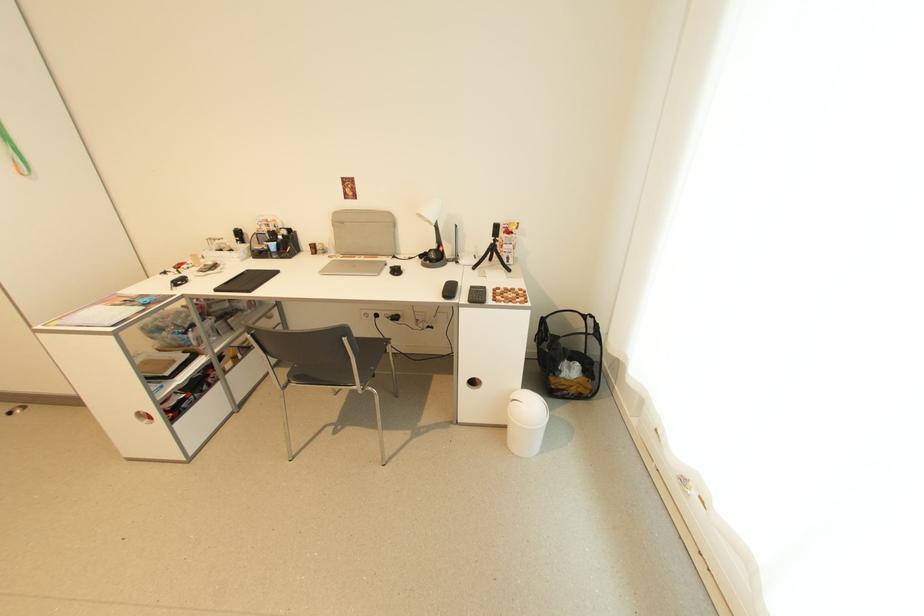
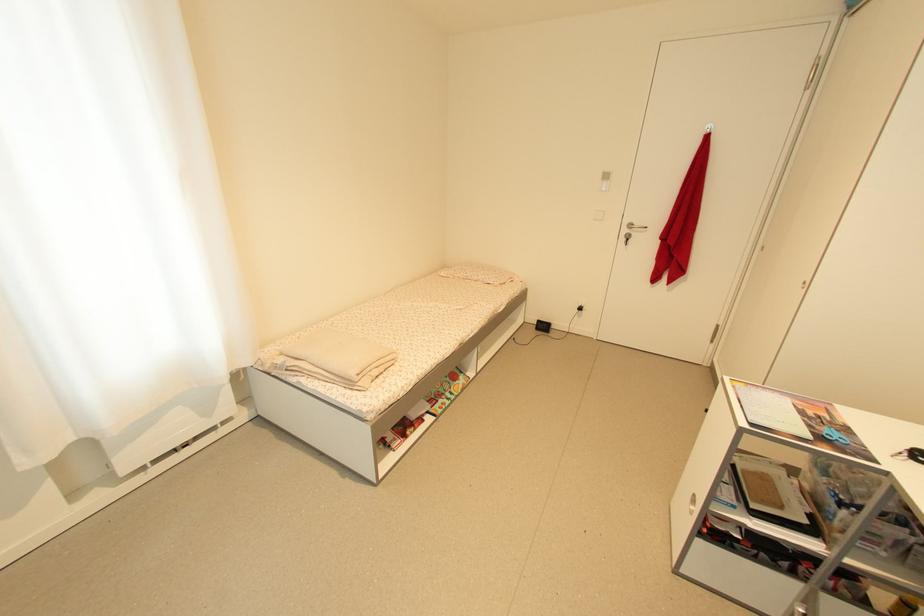
How did the camera likely rotate?

The camera's rotation is toward left-down.